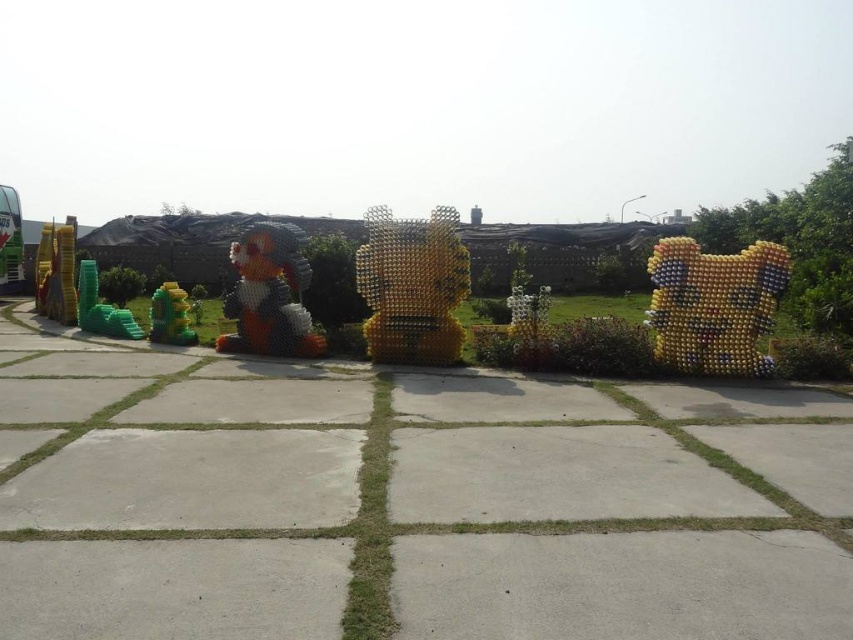
You are standing in front of the sculptures and want to place a new multicolored plastic bottle at right. However, there is already a multicolored plastic bottle at center. Where should you place the new bottle to avoid overlapping with the existing one?

The multicolored plastic bottle at right is located below the multicolored plastic bottle at center, so placing the new bottle above the multicolored plastic bottle at center would avoid overlapping.

Consider the image. You are an art curator planning to move the shiny green toy at lower left closer to the yellow metallic sculpture at center. Considering their sizes, which object will occupy more space after the move?

The yellow metallic sculpture at center will occupy more space than the shiny green toy at lower left because it has a larger size.

You are a photographer setting up for a shoot. You want to capture both the yellow metallic sculpture at center and the shiny green toy at lower left in the same frame without any obstructions. Based on their positions, which object should you focus on first to ensure both are visible?

The yellow metallic sculpture at center is in front of the shiny green toy at lower left, so you should focus on the shiny green toy at lower left first to ensure both are visible in the frame without obstruction.